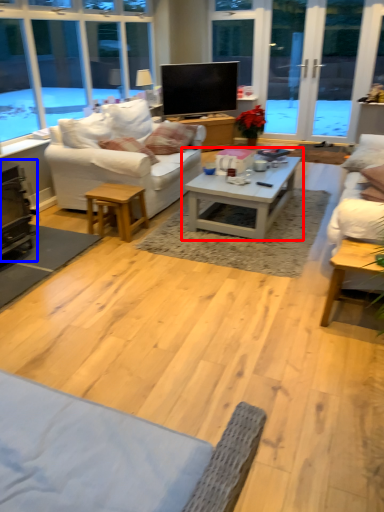
Question: Which of the following is the closest to the observer, coffee table (highlighted by a red box) or fireplace (highlighted by a blue box)?

Choices:
 (A) coffee table
 (B) fireplace

Answer: (A)